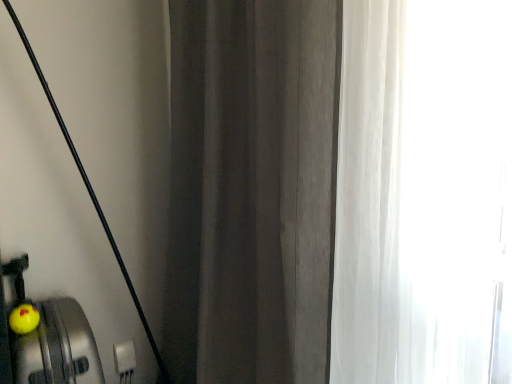
The height and width of the screenshot is (384, 512). What do you see at coordinates (24, 319) in the screenshot?
I see `yellow rubber duck at lower left` at bounding box center [24, 319].

At what (x,y) coordinates should I click in order to perform the action: click on yellow rubber duck at lower left. Please return your answer as a coordinate pair (x, y). Looking at the image, I should click on (24, 319).

The image size is (512, 384). What do you see at coordinates (252, 190) in the screenshot? I see `dark gray fabric curtain at center` at bounding box center [252, 190].

What is the approximate width of dark gray fabric curtain at center?

dark gray fabric curtain at center is 9.17 inches in width.

I want to click on dark gray fabric curtain at center, so point(252,190).

I want to click on yellow rubber duck at lower left, so click(x=24, y=319).

Does dark gray fabric curtain at center appear on the left side of yellow rubber duck at lower left?

In fact, dark gray fabric curtain at center is to the right of yellow rubber duck at lower left.

Which object is closer to the camera, dark gray fabric curtain at center or yellow rubber duck at lower left?

Positioned in front is dark gray fabric curtain at center.

Between point (283, 181) and point (10, 323), which one is positioned behind?

The point (10, 323) is farther.

In the scene shown: From the image's perspective, which is above, dark gray fabric curtain at center or yellow rubber duck at lower left?

dark gray fabric curtain at center.

From a real-world perspective, is dark gray fabric curtain at center on top of yellow rubber duck at lower left?

Yes.

Considering the sizes of objects dark gray fabric curtain at center and yellow rubber duck at lower left in the image provided, who is thinner, dark gray fabric curtain at center or yellow rubber duck at lower left?

With smaller width is yellow rubber duck at lower left.

Is dark gray fabric curtain at center taller or shorter than yellow rubber duck at lower left?

Considering their sizes, dark gray fabric curtain at center has more height than yellow rubber duck at lower left.

Can you confirm if dark gray fabric curtain at center is smaller than yellow rubber duck at lower left?

Incorrect, dark gray fabric curtain at center is not smaller in size than yellow rubber duck at lower left.

Can yellow rubber duck at lower left be found inside dark gray fabric curtain at center?

Actually, yellow rubber duck at lower left is outside dark gray fabric curtain at center.

Is dark gray fabric curtain at center directly adjacent to yellow rubber duck at lower left?

No, dark gray fabric curtain at center is not touching yellow rubber duck at lower left.

Is dark gray fabric curtain at center turned away from yellow rubber duck at lower left?

Yes.

How many degrees apart are the facing directions of dark gray fabric curtain at center and yellow rubber duck at lower left?

dark gray fabric curtain at center and yellow rubber duck at lower left are facing 91.6 degrees away from each other.

How distant is dark gray fabric curtain at center from yellow rubber duck at lower left?

A distance of 33.04 inches exists between dark gray fabric curtain at center and yellow rubber duck at lower left.

Where is `curtain in front of the yellow rubber duck at lower left`? curtain in front of the yellow rubber duck at lower left is located at coordinates tap(252, 190).

Which object is positioned more to the right, yellow rubber duck at lower left or dark gray fabric curtain at center?

From the viewer's perspective, dark gray fabric curtain at center appears more on the right side.

Which object is further away from the camera taking this photo, yellow rubber duck at lower left or dark gray fabric curtain at center?

yellow rubber duck at lower left is further from the camera.

Considering the positions of point (21, 307) and point (276, 270), is point (21, 307) closer or farther from the camera than point (276, 270)?

Point (21, 307) is positioned farther from the camera compared to point (276, 270).

From the image's perspective, relative to dark gray fabric curtain at center, is yellow rubber duck at lower left above or below?

Clearly, from the image's perspective, yellow rubber duck at lower left is below dark gray fabric curtain at center.

From a real-world perspective, does yellow rubber duck at lower left sit lower than dark gray fabric curtain at center?

Indeed, from a real-world perspective, yellow rubber duck at lower left is positioned beneath dark gray fabric curtain at center.

Considering the relative sizes of yellow rubber duck at lower left and dark gray fabric curtain at center in the image provided, is yellow rubber duck at lower left wider than dark gray fabric curtain at center?

No, yellow rubber duck at lower left is not wider than dark gray fabric curtain at center.

Who is shorter, yellow rubber duck at lower left or dark gray fabric curtain at center?

Standing shorter between the two is yellow rubber duck at lower left.

Considering the sizes of yellow rubber duck at lower left and dark gray fabric curtain at center in the image, is yellow rubber duck at lower left bigger or smaller than dark gray fabric curtain at center?

yellow rubber duck at lower left is smaller than dark gray fabric curtain at center.

Is dark gray fabric curtain at center inside yellow rubber duck at lower left?

No.

Is yellow rubber duck at lower left not close to dark gray fabric curtain at center?

yellow rubber duck at lower left is actually quite close to dark gray fabric curtain at center.

Could you tell me if yellow rubber duck at lower left is turned towards dark gray fabric curtain at center?

No, yellow rubber duck at lower left is not oriented towards dark gray fabric curtain at center.

What's the angular difference between yellow rubber duck at lower left and dark gray fabric curtain at center's facing directions?

yellow rubber duck at lower left and dark gray fabric curtain at center are facing 91.6 degrees away from each other.

I want to click on curtain located above the yellow rubber duck at lower left (from the image's perspective), so click(x=252, y=190).

This screenshot has width=512, height=384. In order to click on curtain that appears above the yellow rubber duck at lower left (from a real-world perspective) in this screenshot , I will do pyautogui.click(x=252, y=190).

Image resolution: width=512 pixels, height=384 pixels. In order to click on curtain in front of the yellow rubber duck at lower left in this screenshot , I will do `click(252, 190)`.